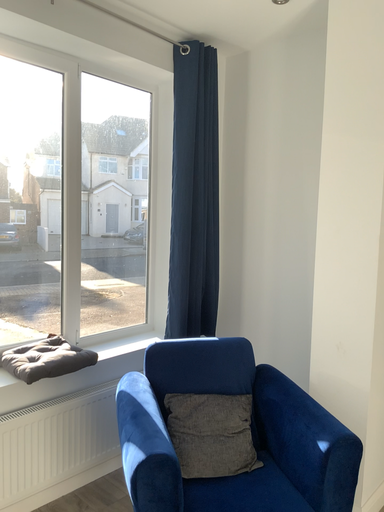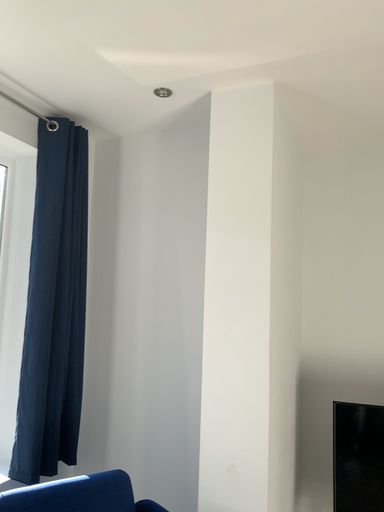
Question: Which way did the camera rotate in the video?

Choices:
 (A) rotated upward
 (B) rotated downward

Answer: (A)